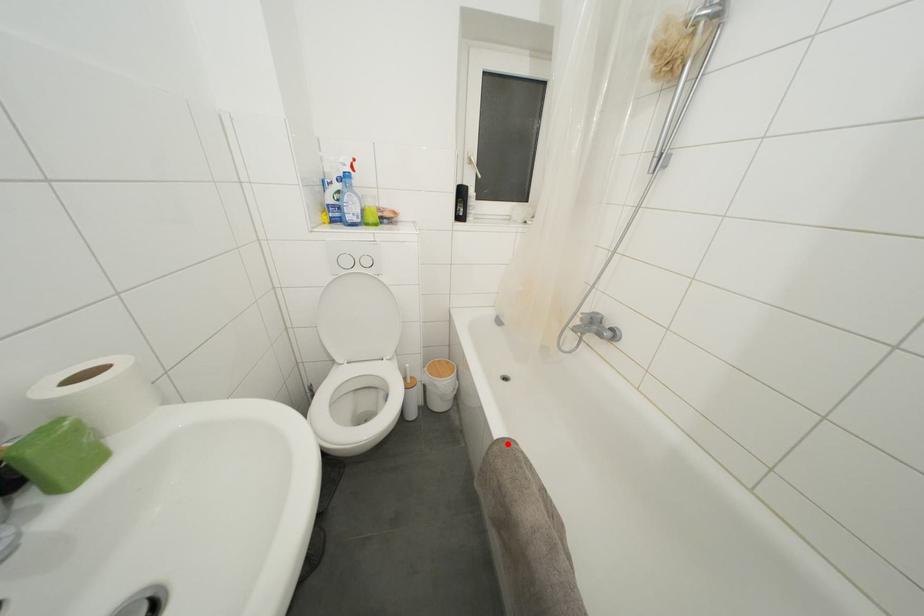
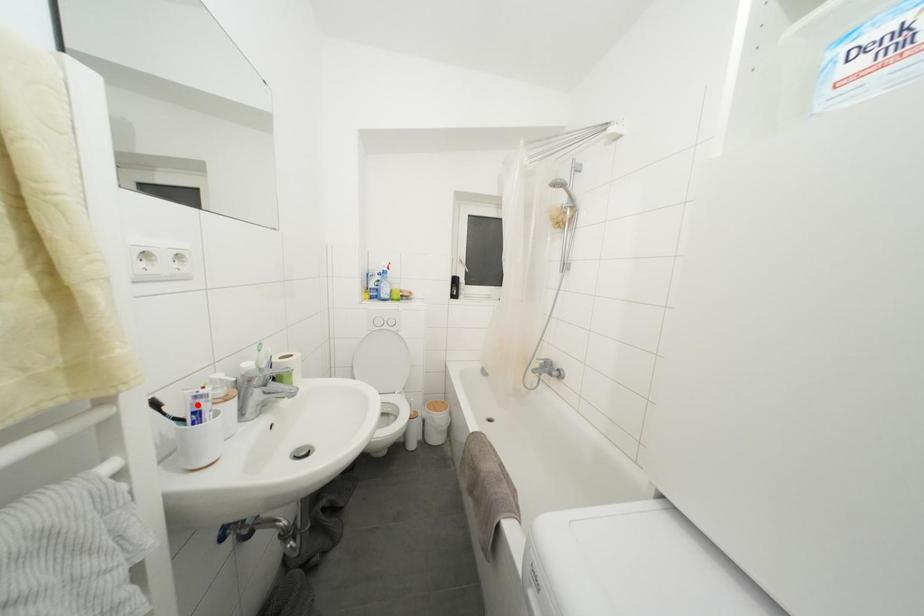
I am providing you with two images of the same scene from different viewpoints. A red point is marked on the first image and another point is marked on the second image. Is the marked point in image1 the same physical position as the marked point in image2?

No